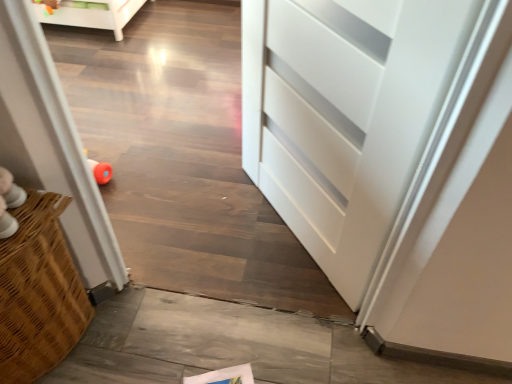
Question: Does white glossy screen door at left have a lesser width compared to multicolored plastic toy at upper left?

Choices:
 (A) no
 (B) yes

Answer: (A)

Question: Does white glossy screen door at left lie behind multicolored plastic toy at upper left?

Choices:
 (A) no
 (B) yes

Answer: (A)

Question: From the image's perspective, is white glossy screen door at left on multicolored plastic toy at upper left?

Choices:
 (A) yes
 (B) no

Answer: (B)

Question: Could you tell me if white glossy screen door at left is turned towards multicolored plastic toy at upper left?

Choices:
 (A) no
 (B) yes

Answer: (A)

Question: Can you confirm if white glossy screen door at left is wider than multicolored plastic toy at upper left?

Choices:
 (A) no
 (B) yes

Answer: (B)

Question: Can we say white glossy screen door at left lies outside multicolored plastic toy at upper left?

Choices:
 (A) no
 (B) yes

Answer: (B)

Question: Could you tell me if multicolored plastic toy at upper left is turned towards white glossy screen door at left?

Choices:
 (A) no
 (B) yes

Answer: (A)

Question: Does multicolored plastic toy at upper left have a lesser height compared to white glossy screen door at left?

Choices:
 (A) yes
 (B) no

Answer: (A)

Question: Does multicolored plastic toy at upper left contain white glossy screen door at left?

Choices:
 (A) yes
 (B) no

Answer: (B)

Question: Would you say multicolored plastic toy at upper left is a long distance from white glossy screen door at left?

Choices:
 (A) yes
 (B) no

Answer: (A)

Question: Is multicolored plastic toy at upper left smaller than white glossy screen door at left?

Choices:
 (A) yes
 (B) no

Answer: (A)

Question: Does multicolored plastic toy at upper left have a larger size compared to white glossy screen door at left?

Choices:
 (A) yes
 (B) no

Answer: (B)

Question: Is white glossy screen door at left in front of or behind multicolored plastic toy at upper left in the image?

Choices:
 (A) behind
 (B) front

Answer: (B)